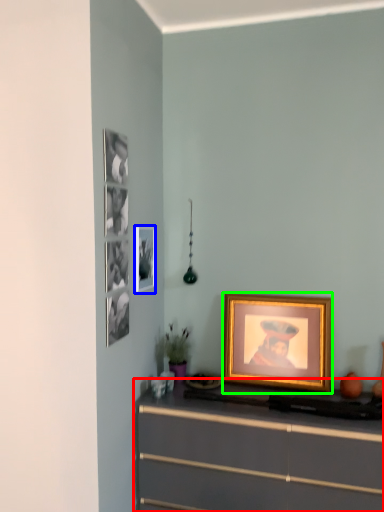
Question: Which is farther away from chest of drawers (highlighted by a red box)? picture frame (highlighted by a blue box) or picture frame (highlighted by a green box)?

Choices:
 (A) picture frame
 (B) picture frame

Answer: (A)